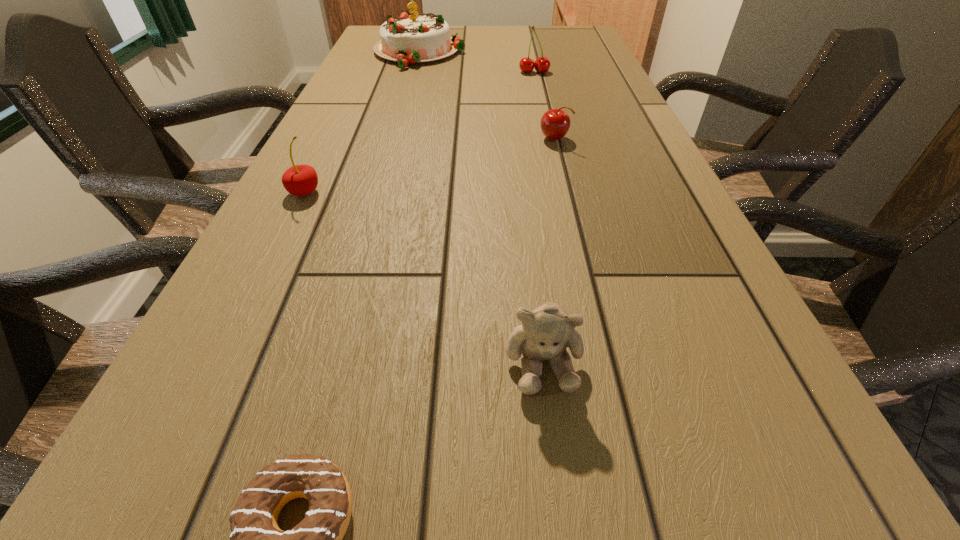
Locate an element on the screen. Image resolution: width=960 pixels, height=540 pixels. cake is located at coordinates (409, 39).

Where is `the farthest cherry`? the farthest cherry is located at coordinates (542, 64).

What are the coordinates of `the leftmost cherry` in the screenshot? It's located at (299, 180).

Locate an element on the screen. The height and width of the screenshot is (540, 960). the fourth farthest object is located at coordinates (299, 180).

Locate an element on the screen. The height and width of the screenshot is (540, 960). the second nearest object is located at coordinates (546, 331).

This screenshot has height=540, width=960. I want to click on the third farthest object, so click(x=555, y=123).

The image size is (960, 540). I want to click on the second nearest cherry, so click(555, 123).

The height and width of the screenshot is (540, 960). In order to click on blank area located 0.360m on the right of the cake in this screenshot , I will do `click(580, 53)`.

The width and height of the screenshot is (960, 540). I want to click on vacant region located 0.170m with the stems of the farthest cherry pointing upwards, so click(x=540, y=101).

The height and width of the screenshot is (540, 960). What are the coordinates of `blank space located on the back of the nearest cherry` in the screenshot? It's located at (341, 119).